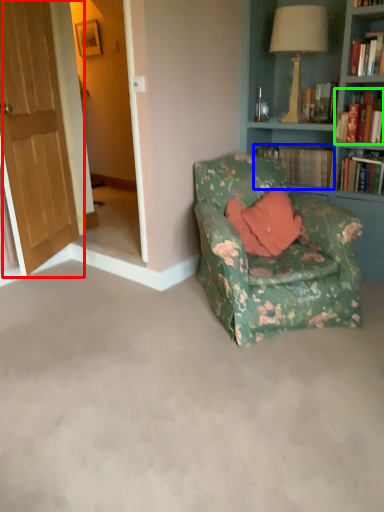
Question: Estimate the real-world distances between objects in this image. Which object is farther from door (highlighted by a red box), book (highlighted by a blue box) or book (highlighted by a green box)?

Choices:
 (A) book
 (B) book

Answer: (B)